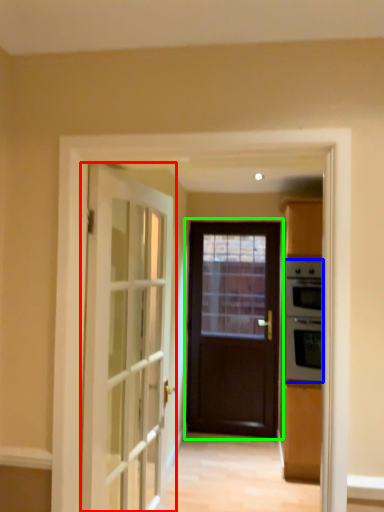
Question: Based on their relative distances, which object is nearer to door (highlighted by a red box)? Choose from appliance (highlighted by a blue box) and door (highlighted by a green box).

Choices:
 (A) appliance
 (B) door

Answer: (A)